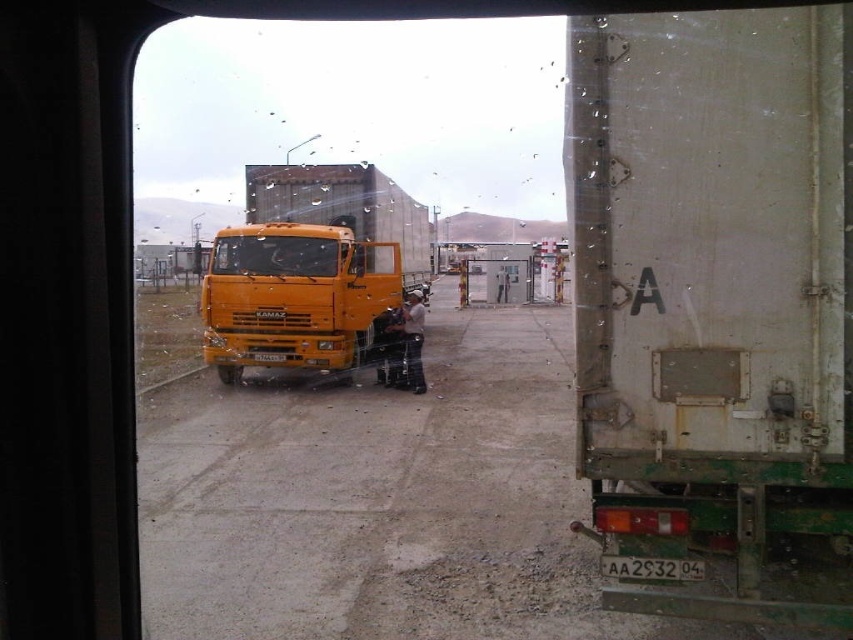
From the picture: You are a driver who needs to back up your vehicle to load cargo. The rusty metal trailer at right and orange matte truck at center are in your way. Which object is positioned lower and closer to the ground, allowing you to maneuver around it more easily?

The rusty metal trailer at right is below orange matte truck at center, meaning it is positioned lower and closer to the ground, so you can maneuver around it more easily.

You are sitting in the vehicle and want to know which of the two points, point (630, 449) or point (241, 262), is nearer to you through the window. Can you determine this based on the scene?

Point (630, 449) is closer to the viewer than point (241, 262), so the point at (630, 449) is nearer to you.